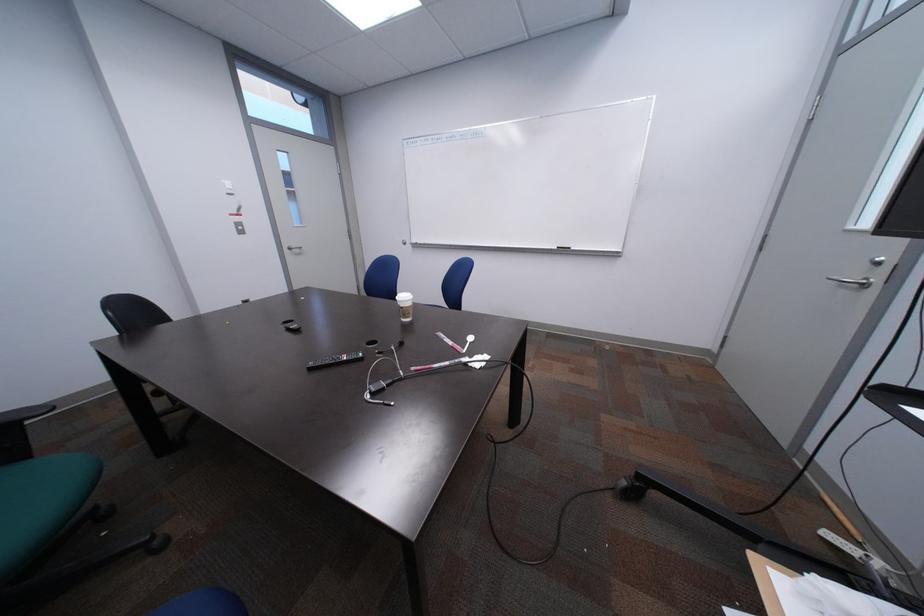
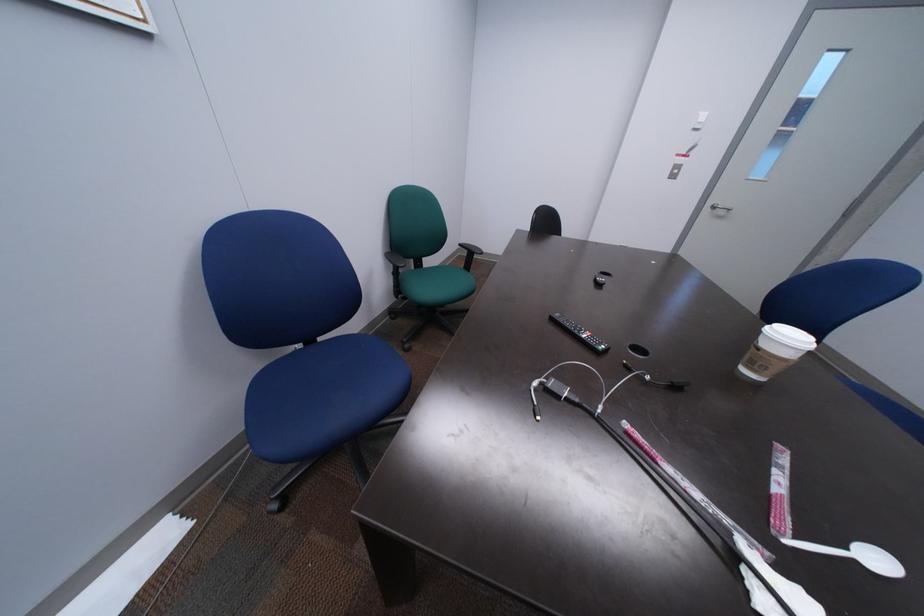
Based on the continuous images, in which direction is the camera rotating?

The camera rotated toward left-down.